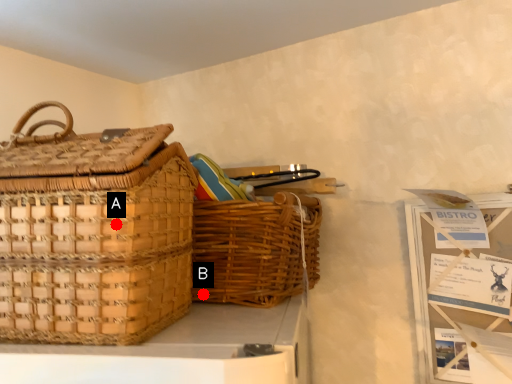
Question: Two points are circled on the image, labeled by A and B beside each circle. Which point is closer to the camera?

Choices:
 (A) A is closer
 (B) B is closer

Answer: (A)